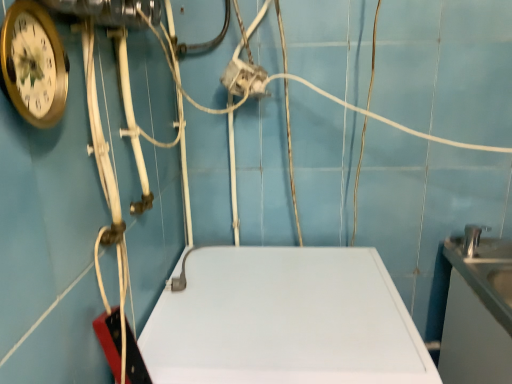
Question: From the image's perspective, is satin silver sink at right located above or below white matte counter top at center, the second counter top positioned from the right?

Choices:
 (A) below
 (B) above

Answer: (B)

Question: Do you think satin silver sink at right is within white matte counter top at center, the second counter top positioned from the right, or outside of it?

Choices:
 (A) inside
 (B) outside

Answer: (B)

Question: Which is nearer to the satin silver sink at right?

Choices:
 (A) white glossy counter top at right, which appears as the second counter top when viewed from the left
 (B) white matte counter top at center, positioned as the first counter top in left-to-right order

Answer: (A)

Question: Which is nearer to the white glossy counter top at right, the 1th counter top viewed from the right?

Choices:
 (A) satin silver sink at right
 (B) white matte counter top at center, the second counter top positioned from the right

Answer: (A)